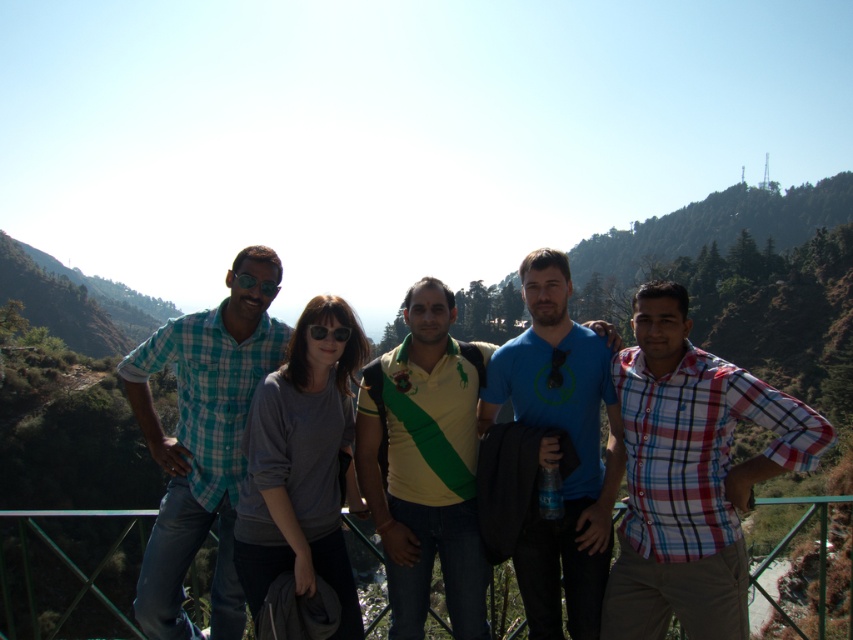
You are a photographer trying to capture a clear shot of both the plaid cotton shirt at right and the teal plaid shirt at left. Since you want to ensure both shirts are visible in the photo, which shirt should you focus on first to account for their sizes?

The plaid cotton shirt at right is bigger than the teal plaid shirt at left, so you should focus on the plaid cotton shirt at right first to ensure it is in clear focus before adjusting for the smaller teal plaid shirt at left.

You are standing at the point with coordinates point (425,465) in the image. What object is located at that point?

The point (425,465) corresponds to the yellow green jersey at center.